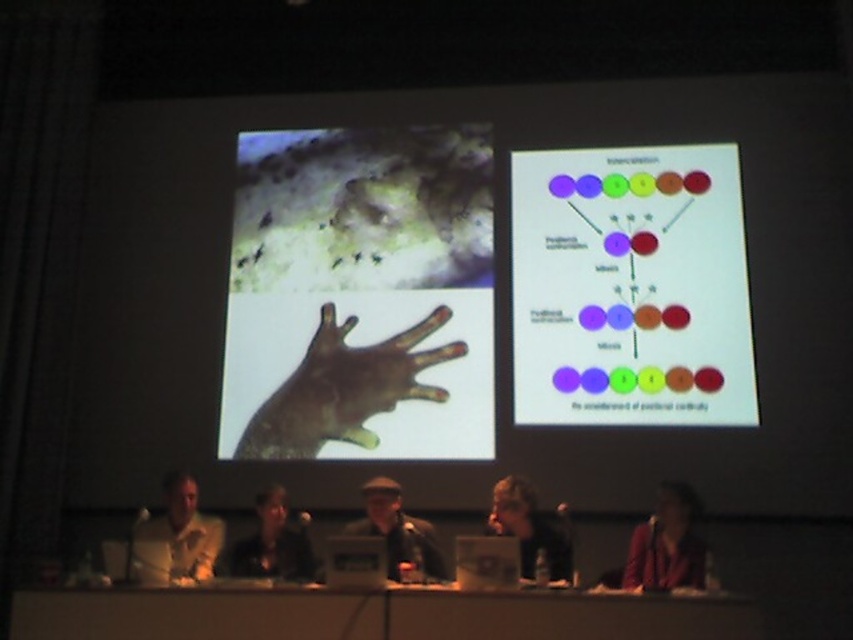
You are an attendee at the presentation and want to take a photo of both the matte plastic diagram at upper right and the brown matte hand at center on the screen. Since your phone camera has a limited zoom feature, you need to know which one is bigger to focus better. Which object is larger?

The matte plastic diagram at upper right is larger compared to the brown matte hand at center, so you should focus on the matte plastic diagram at upper right first as it is bigger and easier to capture clearly.

You are an attendee at the presentation and notice two points displayed on the screen. The first point is labeled as point at position (521, 480) and the second is point at position (271, 556). From your perspective, which point appears closer to you?

Point at position (271, 556) appears closer because it is in front of point at position (521, 480).